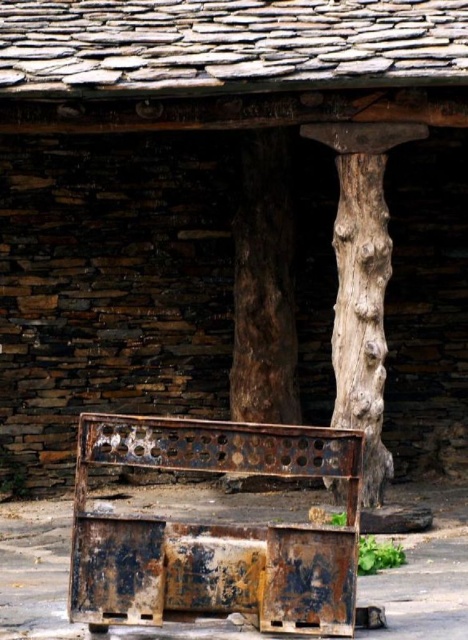
Question: Is brown rough tree trunk at center behind rough bark tree trunk at center?

Choices:
 (A) no
 (B) yes

Answer: (B)

Question: Is rusty metal bench at center bigger than brown rough tree trunk at center?

Choices:
 (A) no
 (B) yes

Answer: (B)

Question: Which point is farther to the camera?

Choices:
 (A) (165, 454)
 (B) (240, 266)
 (C) (350, 246)

Answer: (B)

Question: Is brown rough tree trunk at center further to the viewer compared to rough bark tree trunk at center?

Choices:
 (A) yes
 (B) no

Answer: (A)

Question: Which object appears closest to the camera in this image?

Choices:
 (A) brown rough tree trunk at center
 (B) rusty metal bench at center
 (C) rough bark tree trunk at center

Answer: (B)

Question: Considering the real-world distances, which object is farthest from the rough bark tree trunk at center?

Choices:
 (A) brown rough tree trunk at center
 (B) rusty metal bench at center

Answer: (B)